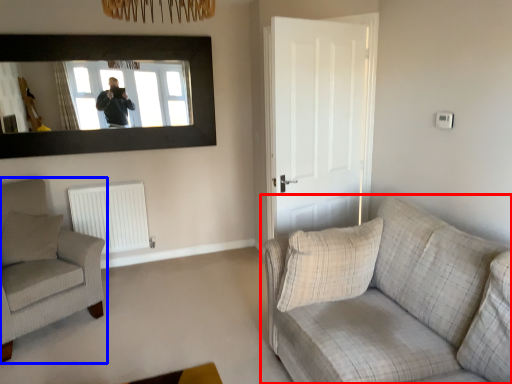
Question: Which object is closer to the camera taking this photo, studio couch (highlighted by a red box) or chair (highlighted by a blue box)?

Choices:
 (A) studio couch
 (B) chair

Answer: (A)